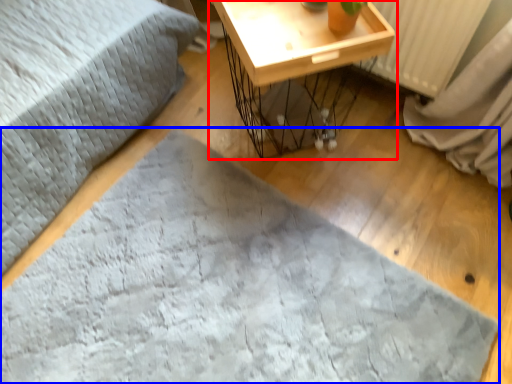
Question: Which object appears farthest to the camera in this image, table (highlighted by a red box) or sheet (highlighted by a blue box)?

Choices:
 (A) table
 (B) sheet

Answer: (A)